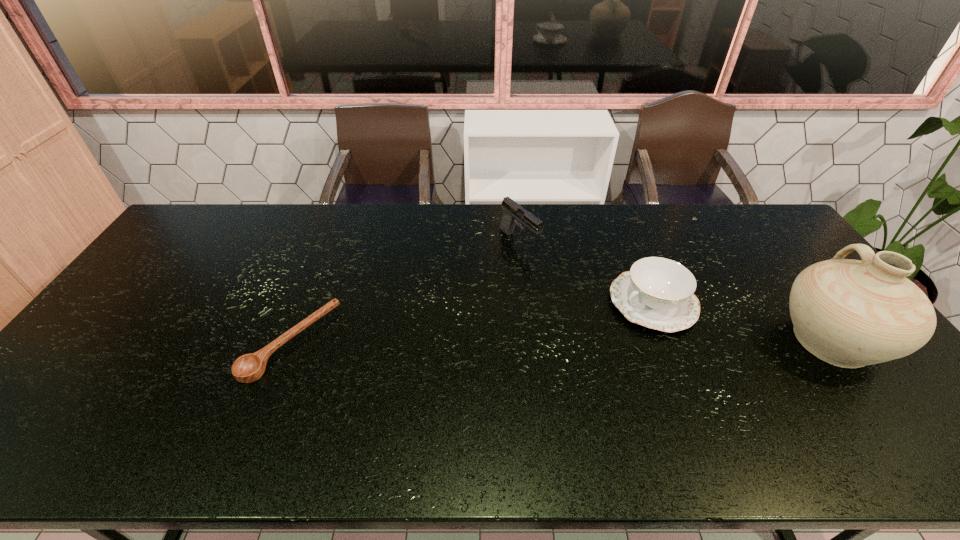
What are the coordinates of `object at the near right corner` in the screenshot? It's located at (849, 313).

Identify the location of vacant space at the far edge of the desktop. The width and height of the screenshot is (960, 540). (243, 219).

Image resolution: width=960 pixels, height=540 pixels. In the image, there is a desktop. Find the location of `vacant area at the near edge`. vacant area at the near edge is located at coordinates (235, 400).

Find the location of a particular element. The width and height of the screenshot is (960, 540). vacant space at the left edge is located at coordinates (143, 326).

Where is `vacant region at the far left corner of the desktop`? The width and height of the screenshot is (960, 540). vacant region at the far left corner of the desktop is located at coordinates (201, 227).

The width and height of the screenshot is (960, 540). I want to click on blank space at the near left corner, so click(70, 393).

Locate an element on the screen. free space at the far right corner of the desktop is located at coordinates (731, 212).

Where is `free space between the third shortest object and the leftmost object`? This screenshot has width=960, height=540. free space between the third shortest object and the leftmost object is located at coordinates (405, 292).

At what (x,y) coordinates should I click in order to perform the action: click on vacant area that lies between the chinaware and the pistol. Please return your answer as a coordinate pair (x, y). Looking at the image, I should click on (587, 272).

Find the location of a particular element. The width and height of the screenshot is (960, 540). free space between the pistol and the second shortest object is located at coordinates point(587,272).